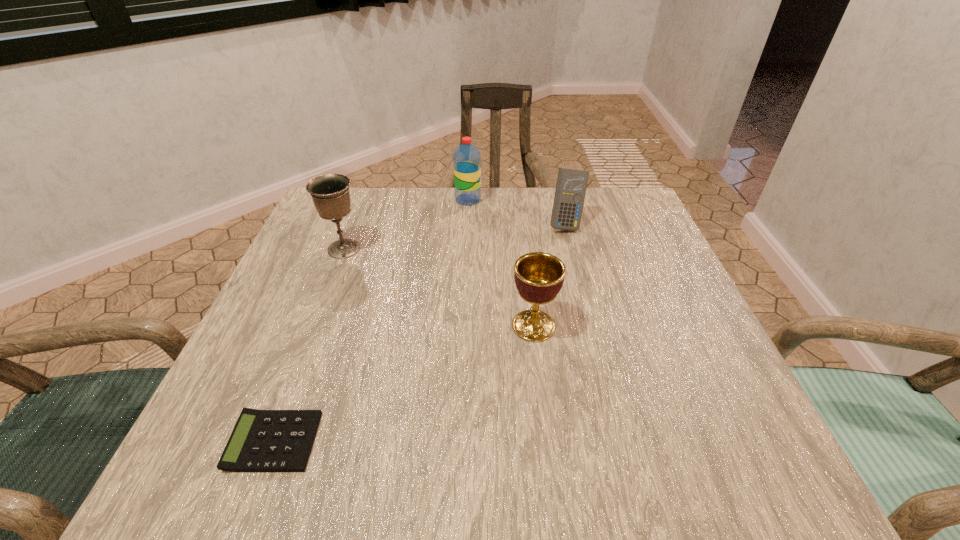
The height and width of the screenshot is (540, 960). Identify the location of blank area located on the front label of the farthest object. (531, 200).

Find the location of `vacant space situated 0.230m on the front of the third farthest object`. vacant space situated 0.230m on the front of the third farthest object is located at coordinates (308, 342).

The width and height of the screenshot is (960, 540). I want to click on vacant space located on the front-facing side of the taller calculator, so click(585, 297).

This screenshot has width=960, height=540. I want to click on free space located 0.070m on the right of the shorter chalice, so click(594, 326).

Where is `free space located on the back of the left calculator`? The image size is (960, 540). free space located on the back of the left calculator is located at coordinates (300, 370).

The width and height of the screenshot is (960, 540). Find the location of `water bottle at the far edge`. water bottle at the far edge is located at coordinates (466, 159).

Locate an element on the screen. chalice situated at the far edge is located at coordinates (330, 193).

Locate an element on the screen. This screenshot has height=540, width=960. calculator at the far edge is located at coordinates (571, 186).

Image resolution: width=960 pixels, height=540 pixels. What are the coordinates of `object at the near edge` in the screenshot? It's located at (262, 440).

Locate an element on the screen. The image size is (960, 540). chalice positioned at the left edge is located at coordinates (330, 193).